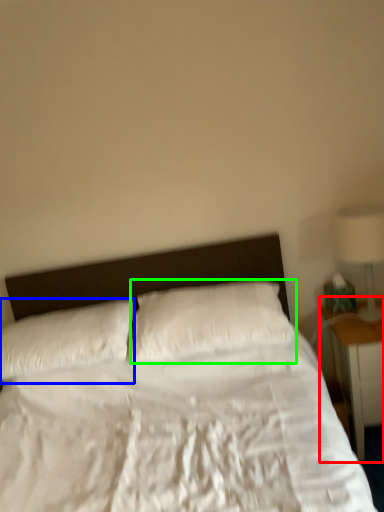
Question: Considering the real-world distances, which object is closest to nightstand (highlighted by a red box)? pillow (highlighted by a blue box) or pillow (highlighted by a green box).

Choices:
 (A) pillow
 (B) pillow

Answer: (B)